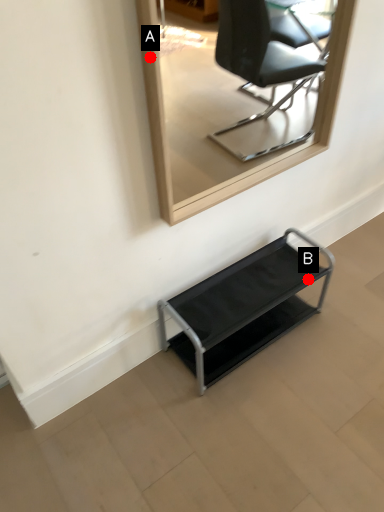
Question: Two points are circled on the image, labeled by A and B beside each circle. Which point appears farthest from the camera in this image?

Choices:
 (A) A is further
 (B) B is further

Answer: (B)